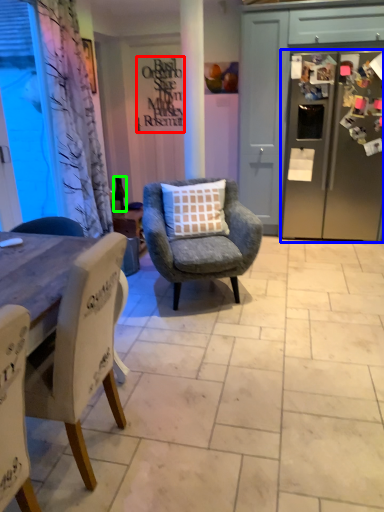
Question: Estimate the real-world distances between objects in this image. Which object is closer to writing (highlighted by a red box), refrigerator (highlighted by a blue box) or bottle (highlighted by a green box)?

Choices:
 (A) refrigerator
 (B) bottle

Answer: (B)